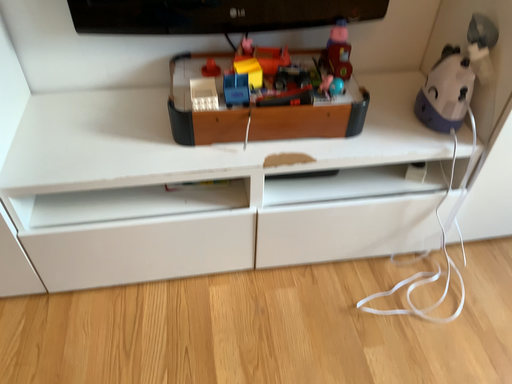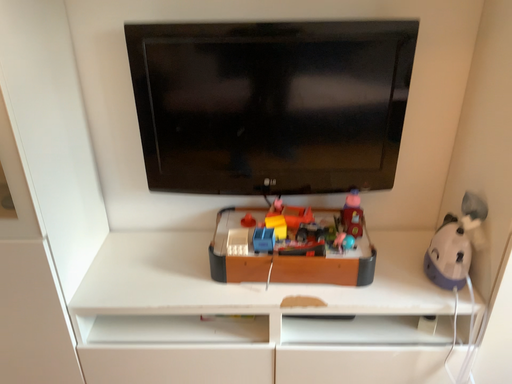
Question: Which way did the camera rotate in the video?

Choices:
 (A) rotated left
 (B) rotated right

Answer: (A)